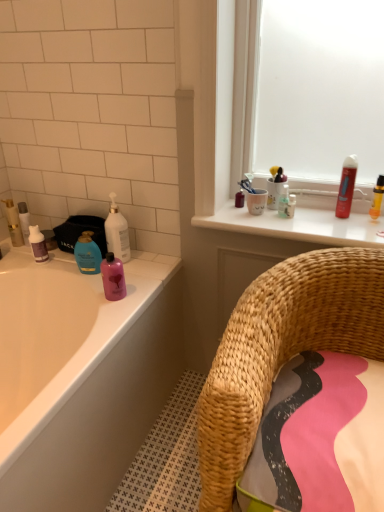
The height and width of the screenshot is (512, 384). I want to click on free location to the left of red glossy mouthwash at upper right, arranged as the 3th mouthwash when viewed from the left, so click(302, 218).